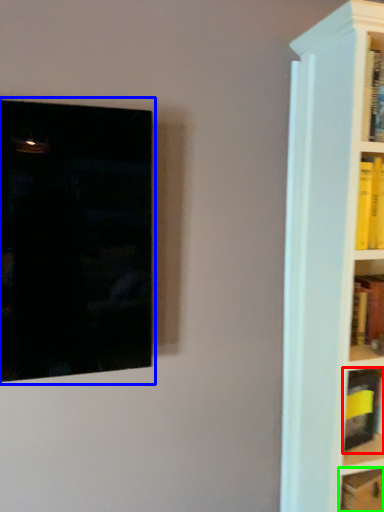
Question: Which object is positioned farthest from book (highlighted by a red box)? Select from picture frame (highlighted by a blue box) and book (highlighted by a green box).

Choices:
 (A) picture frame
 (B) book

Answer: (A)